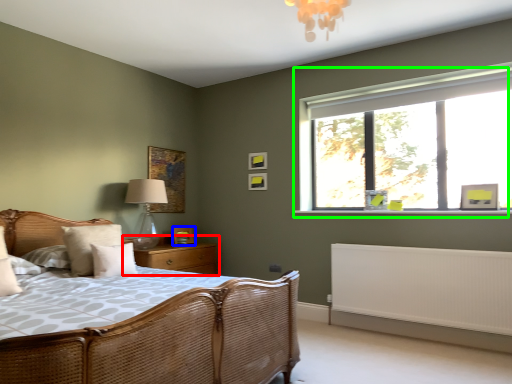
Question: Based on their relative distances, which object is farther from nightstand (highlighted by a red box)? Choose from picture frame (highlighted by a blue box) and window (highlighted by a green box).

Choices:
 (A) picture frame
 (B) window

Answer: (B)